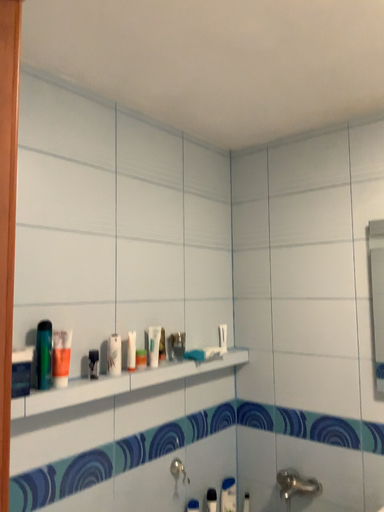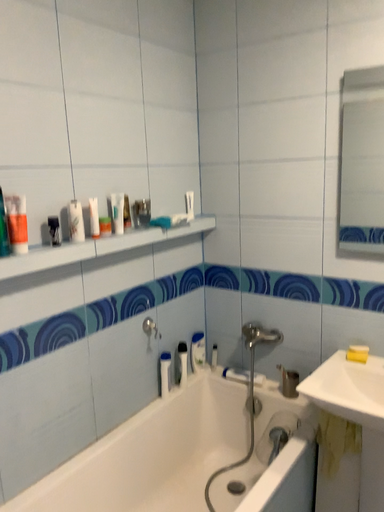
Question: How did the camera likely rotate when shooting the video?

Choices:
 (A) rotated downward
 (B) rotated upward

Answer: (A)